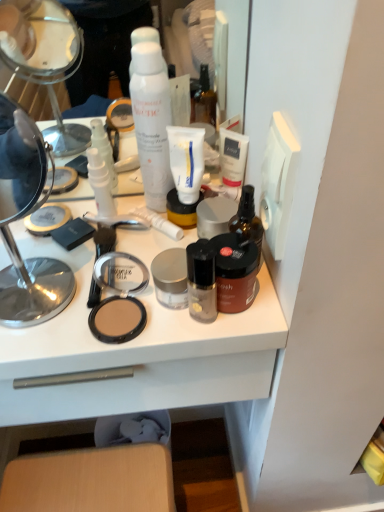
Find the location of a particular element. vacant space to the left of white matte tube at center is located at coordinates (73, 241).